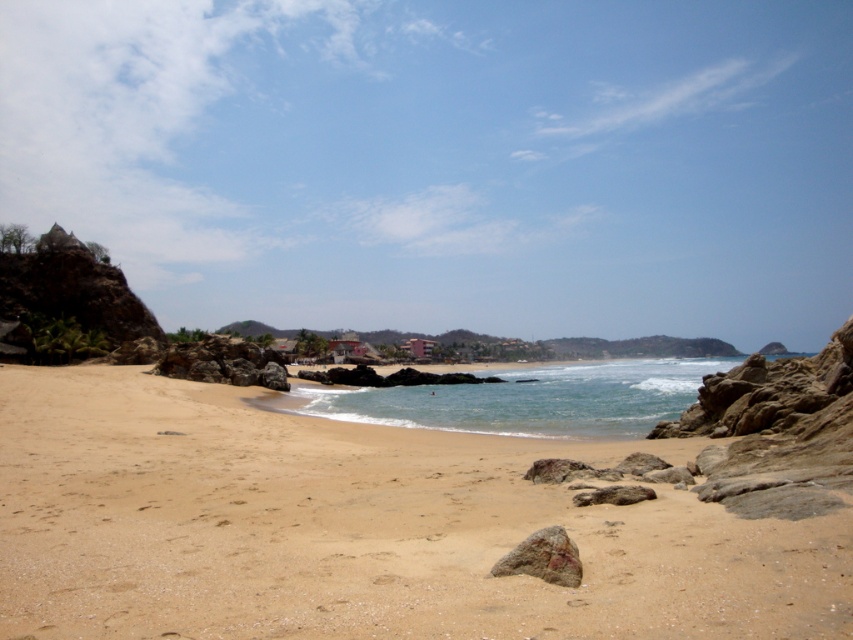
Is the position of clear blue water at center less distant than that of rusty rock at center?

No, clear blue water at center is further to the viewer.

Can you confirm if clear blue water at center is positioned to the right of rusty rock at center?

Yes, clear blue water at center is to the right of rusty rock at center.

Which is in front, point (606, 406) or point (515, 556)?

Point (515, 556)

Image resolution: width=853 pixels, height=640 pixels. Identify the location of clear blue water at center. (531, 400).

Which is above, sandy beach at lower left or clear blue water at center?

Positioned higher is sandy beach at lower left.

Between point (73, 486) and point (485, 400), which one is positioned in front?

Point (73, 486)

At what (x,y) coordinates should I click in order to perform the action: click on sandy beach at lower left. Please return your answer as a coordinate pair (x, y). The image size is (853, 640). Looking at the image, I should click on (358, 529).

Does point (515, 467) come farther from viewer compared to point (531, 556)?

Yes, it is behind point (531, 556).

The width and height of the screenshot is (853, 640). I want to click on sandy beach at lower left, so click(x=358, y=529).